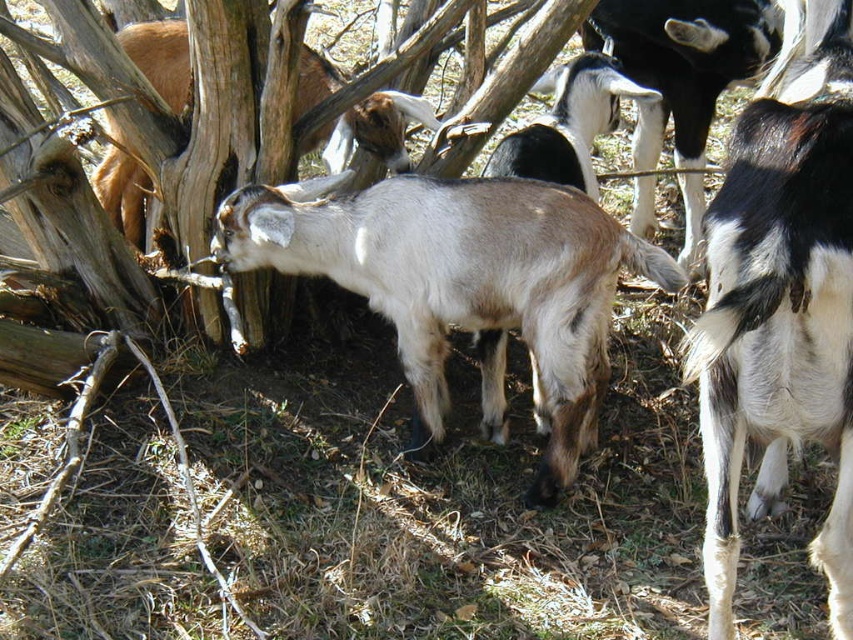
Question: Is light brown woolen goat at center wider than black and white fur goat at center?

Choices:
 (A) no
 (B) yes

Answer: (B)

Question: Does light brown woolen goat at center come in front of black and white fur goat at center?

Choices:
 (A) yes
 (B) no

Answer: (A)

Question: Among these points, which one is nearest to the camera?

Choices:
 (A) (109, 124)
 (B) (407, 360)
 (C) (582, 86)

Answer: (B)

Question: Which of the following is the farthest from the observer?

Choices:
 (A) (508, 301)
 (B) (550, 129)

Answer: (B)

Question: Does light brown woolen goat at center lie in front of black and white fur goat at center?

Choices:
 (A) yes
 (B) no

Answer: (A)

Question: Among these points, which one is nearest to the camera?

Choices:
 (A) (479, 292)
 (B) (408, 97)

Answer: (A)